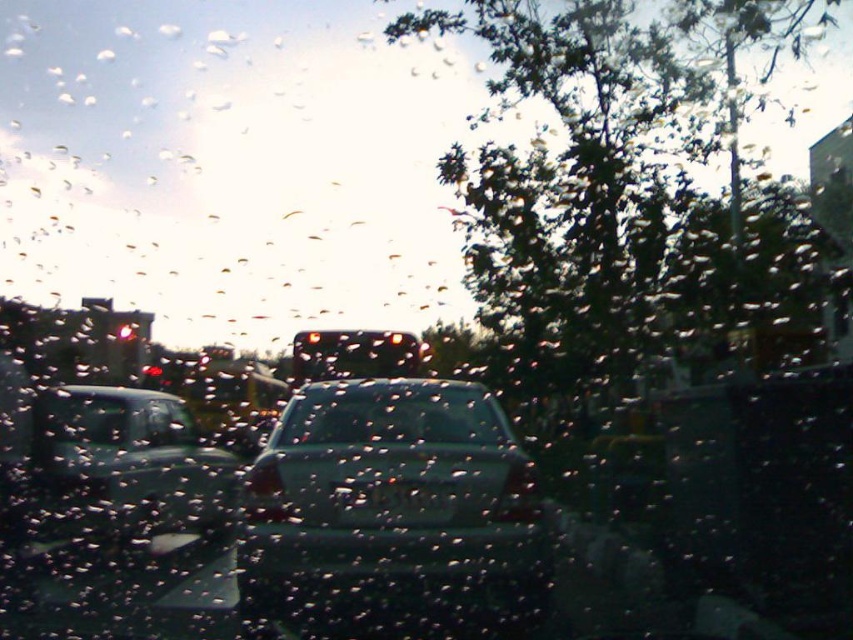
Question: Is the position of green leafy tree at upper right less distant than that of transparent glass car window at center?

Choices:
 (A) yes
 (B) no

Answer: (B)

Question: Which of the following is the closest to the observer?

Choices:
 (A) satin black sedan at left
 (B) satin silver car at center

Answer: (B)

Question: In this image, where is clear glass windshield at center located relative to white plastic license plate at center?

Choices:
 (A) below
 (B) above

Answer: (B)

Question: Estimate the real-world distances between objects in this image. Which object is farther from the white plastic license plate at center?

Choices:
 (A) clear glass car window at lower left
 (B) clear glass windshield at center

Answer: (A)

Question: Which of the following is the closest to the observer?

Choices:
 (A) click(x=142, y=468)
 (B) click(x=469, y=426)
 (C) click(x=180, y=417)

Answer: (B)

Question: Can you confirm if satin silver car at center is positioned to the right of white plastic license plate at center?

Choices:
 (A) yes
 (B) no

Answer: (A)